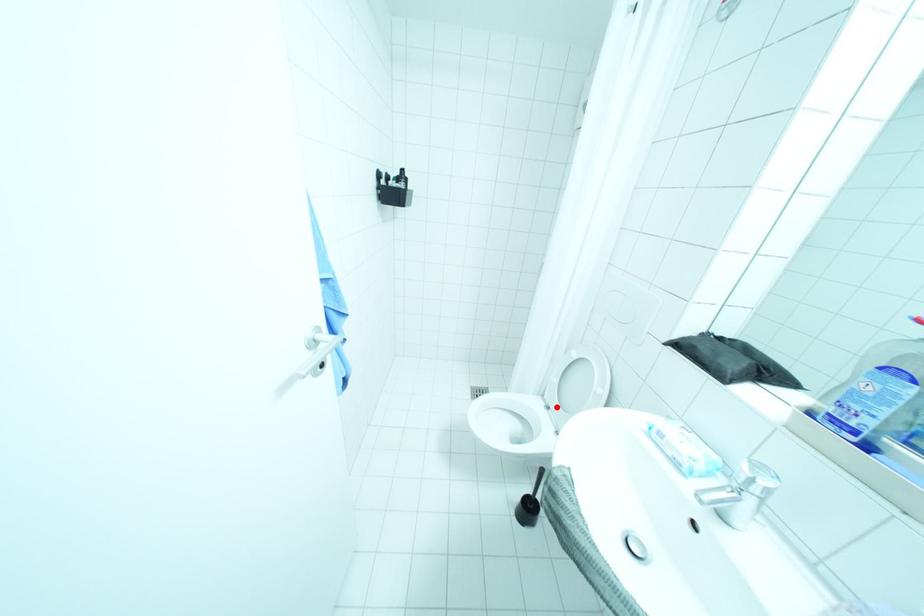
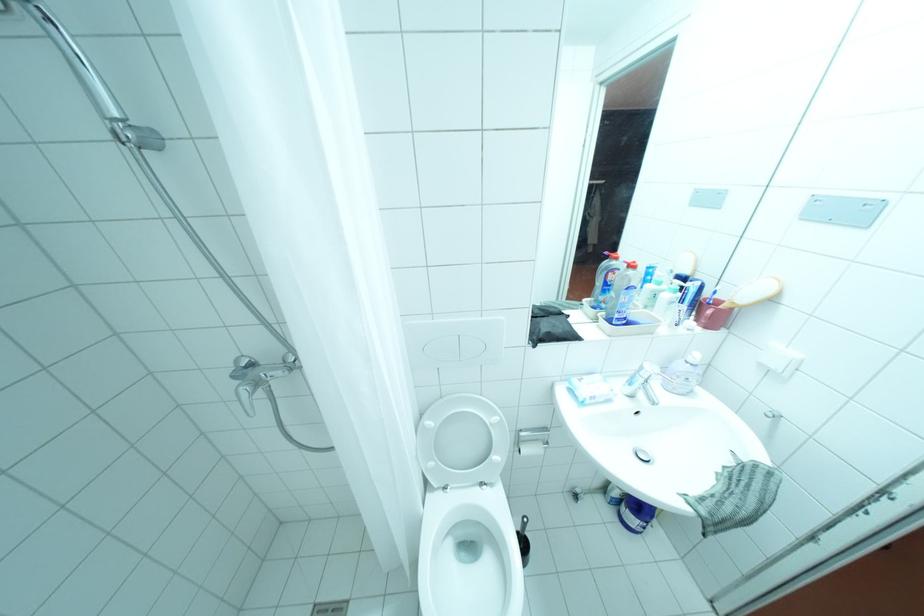
Question: I am providing you with two images of the same scene from different viewpoints. A red point is marked on the first image. Is the red point's position out of view in image 2?

Choices:
 (A) Yes
 (B) No

Answer: (B)